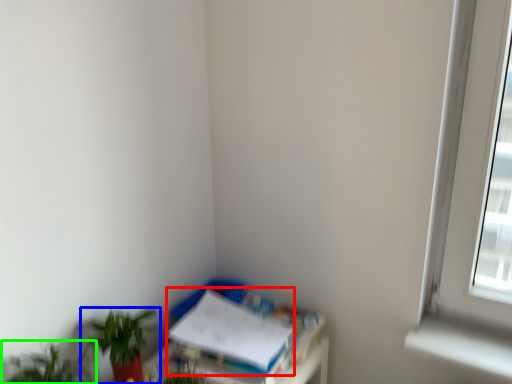
Question: Which object is the farthest from paperback book (highlighted by a red box)? Choose among these: houseplant (highlighted by a blue box) or houseplant (highlighted by a green box).

Choices:
 (A) houseplant
 (B) houseplant

Answer: (B)